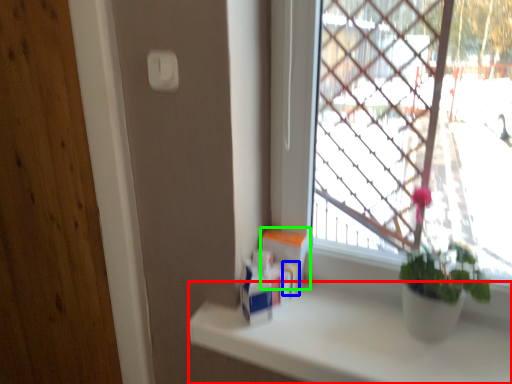
Question: Considering the real-world distances, which object is closest to counter top (highlighted by a red box)? toiletry (highlighted by a blue box) or window box (highlighted by a green box).

Choices:
 (A) toiletry
 (B) window box

Answer: (A)